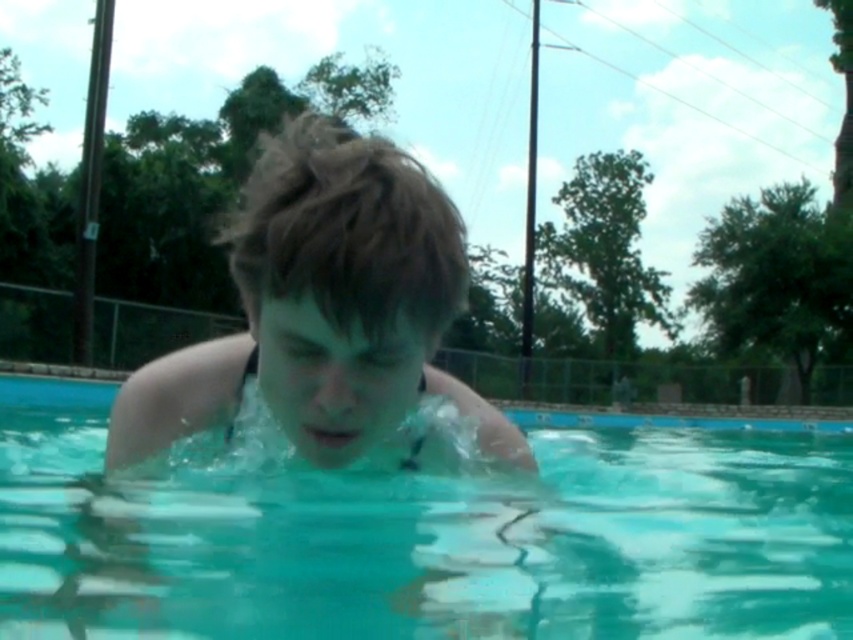
You are a lifeguard observing the pool. You notice the clear blue water at center and the smooth skin boy at center. Which object is positioned lower in the image?

The clear blue water at center is located below the smooth skin boy at center, so the clear blue water at center is positioned lower in the image.

You are standing at the edge of the pool and want to jump into the clear blue water at center. Based on the coordinates provided in the description, is the water directly in front of you or to the side?

Result: The clear blue water at center is located at coordinates point (428, 536), which means it is positioned to the side rather than directly in front of you.

You are a photographer trying to capture the smooth skin boy at center in the clear blue water at center. Since the water is wider than the boy, where should you position your camera to ensure the boy is fully visible in the frame?

The clear blue water at center is wider than the smooth skin boy at center, so positioning the camera to focus on the boy while framing the scene to include the surrounding water will ensure he is fully visible.